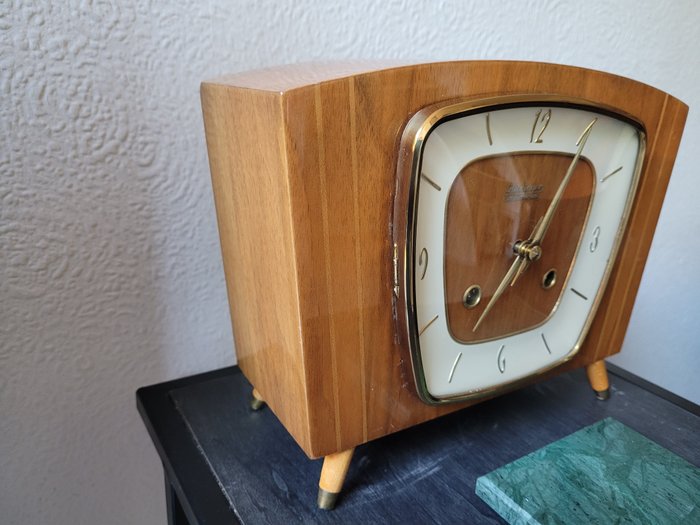
Locate an element on the screen. Image resolution: width=700 pixels, height=525 pixels. back left corner of wooden clock is located at coordinates (204, 84).